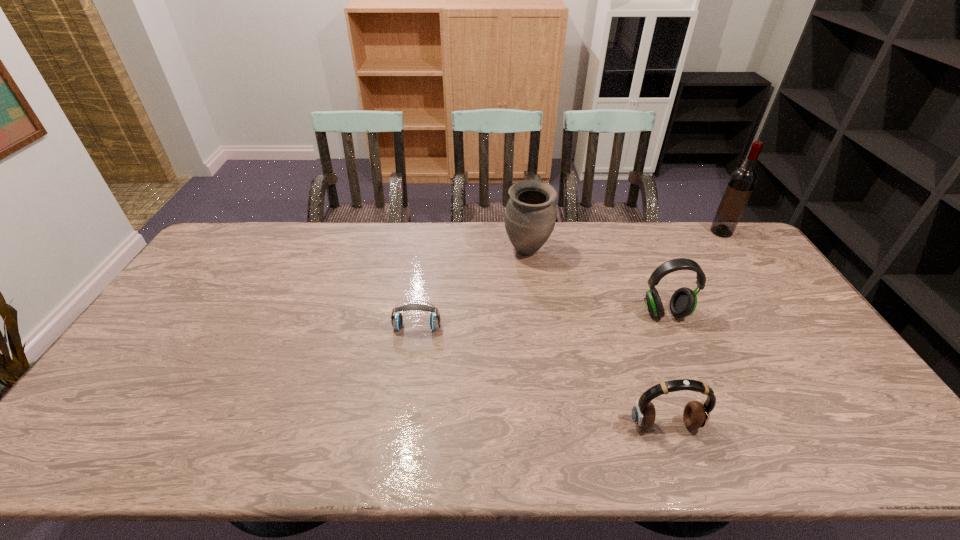
This screenshot has height=540, width=960. In the image, there is a desktop. Find the location of `vacant space at the right edge`. vacant space at the right edge is located at coordinates (859, 393).

Identify the location of free space at the far left corner. (251, 247).

Locate an element on the screen. The image size is (960, 540). vacant region at the near left corner is located at coordinates (121, 436).

Identify the location of free location at the far right corner of the desktop. (708, 222).

Identify the location of vacant space that's between the shortest object and the third shortest object. Image resolution: width=960 pixels, height=540 pixels. (541, 320).

You are a GUI agent. You are given a task and a screenshot of the screen. Output one action in this format:
    pyautogui.click(x=<x>, y=<y>)
    Task: Click on the empty space that is in between the shortest headset and the second object from left to right
    
    Given the screenshot: What is the action you would take?
    pyautogui.click(x=472, y=289)

The image size is (960, 540). Identify the location of empty space between the tallest headset and the rightmost object. (693, 273).

The height and width of the screenshot is (540, 960). I want to click on vacant space in between the second shortest headset and the wine bottle, so click(x=693, y=328).

I want to click on empty location between the wine bottle and the third shortest object, so click(x=693, y=273).

You are a GUI agent. You are given a task and a screenshot of the screen. Output one action in this format:
    pyautogui.click(x=<x>, y=<y>)
    Task: Click on the free spot between the shortest object and the third tallest object
    
    Given the screenshot: What is the action you would take?
    pyautogui.click(x=541, y=320)